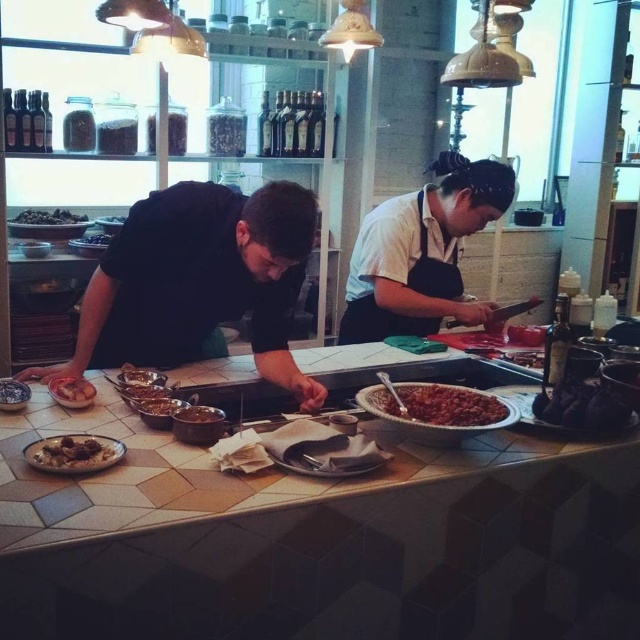
Question: Which point is farther to the camera?

Choices:
 (A) (97, 436)
 (B) (138, 380)
 (C) (579, 384)
 (D) (184, 413)

Answer: (B)

Question: Among these objects, which one is nearest to the camera?

Choices:
 (A) dark brown matte olives at left
 (B) dark brown glossy plate at lower right
 (C) white matte apron at center

Answer: (B)

Question: Estimate the real-world distances between objects in this image. Which object is closer to the brown matte bread at left?

Choices:
 (A) matte silver spoon at center
 (B) brown matte meatballs at lower left
 (C) white matte apron at center

Answer: (A)

Question: Does brown matte bowl at center appear on the left side of dark brown matte olives at left?

Choices:
 (A) no
 (B) yes

Answer: (A)

Question: Can you confirm if black matte chef at left is thinner than shiny dark chocolate at center?

Choices:
 (A) yes
 (B) no

Answer: (B)

Question: Can you confirm if black matte chef at left is positioned below brown matte meatballs at lower left?

Choices:
 (A) no
 (B) yes

Answer: (A)